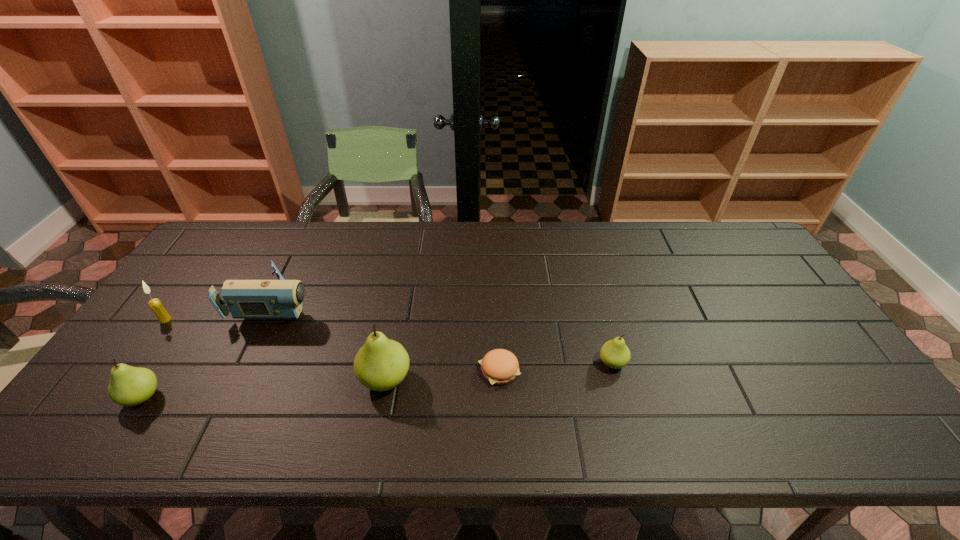
Identify the location of vacant region at the far edge of the desktop. This screenshot has width=960, height=540. (651, 226).

Find the location of a particular element. vacant space at the near edge is located at coordinates (440, 406).

The height and width of the screenshot is (540, 960). Find the location of `vacant area at the left edge`. vacant area at the left edge is located at coordinates (197, 292).

You are a GUI agent. You are given a task and a screenshot of the screen. Output one action in this format:
    pyautogui.click(x=<x>, y=<y>)
    Task: Click on the vacant space at the right edge of the desktop
    
    Given the screenshot: What is the action you would take?
    pyautogui.click(x=796, y=363)

In the image, there is a desktop. What are the coordinates of `vacant space at the far left corner` in the screenshot? It's located at (232, 231).

You are a GUI agent. You are given a task and a screenshot of the screen. Output one action in this format:
    pyautogui.click(x=<x>, y=<y>)
    Task: Click on the vacant space at the far right corner of the desktop
    The height and width of the screenshot is (540, 960).
    Given the screenshot: What is the action you would take?
    pyautogui.click(x=731, y=255)

Find the location of `free space between the shortest object and the candle`. free space between the shortest object and the candle is located at coordinates (332, 345).

This screenshot has width=960, height=540. What are the coordinates of `free spot between the shortest pear and the third object from left to right` in the screenshot? It's located at (445, 333).

I want to click on vacant area that lies between the second tallest pear and the patty, so click(321, 383).

The image size is (960, 540). Identify the location of the fifth closest object to the patty. (162, 315).